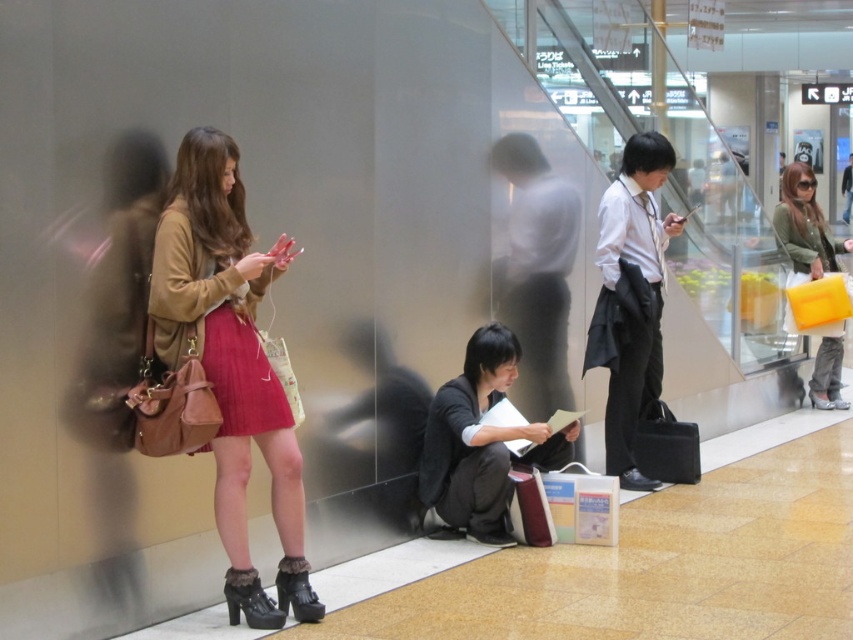
You are a security guard in the station and need to check the items of the two people mentioned. According to the scene description, which item is positioned to the right of the other between the matte brown purse at left and the velvet pink skirt at left?

The matte brown purse at left is to the right of the velvet pink skirt at left.

You are a security guard in the transportation hub and need to check the size of the matte brown purse at left and the velvet pink skirt at left. Which object is larger?

The matte brown purse at left is bigger than the velvet pink skirt at left.